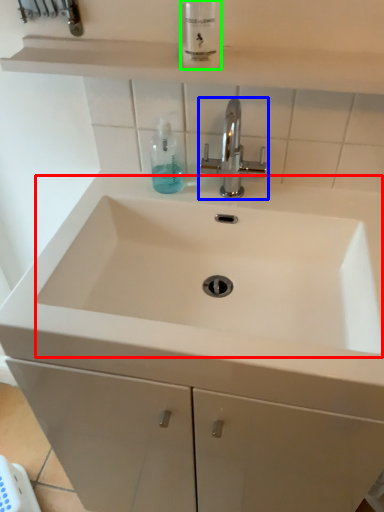
Question: Estimate the real-world distances between objects in this image. Which object is closer to sink (highlighted by a red box), tap (highlighted by a blue box) or mouthwash (highlighted by a green box)?

Choices:
 (A) tap
 (B) mouthwash

Answer: (A)